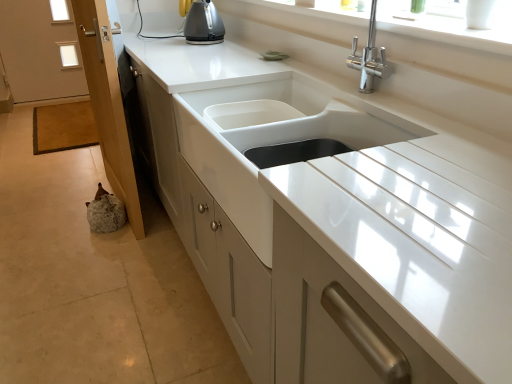
Question: Based on their positions, is wooden screen door at lower left located to the left or right of white glossy sink at center?

Choices:
 (A) right
 (B) left

Answer: (B)

Question: From a real-world perspective, is wooden screen door at lower left physically located above or below white glossy sink at center?

Choices:
 (A) above
 (B) below

Answer: (B)

Question: Does point (97, 71) appear closer or farther from the camera than point (400, 139)?

Choices:
 (A) closer
 (B) farther

Answer: (B)

Question: Is white glossy sink at center spatially inside wooden screen door at lower left, or outside of it?

Choices:
 (A) outside
 (B) inside

Answer: (A)

Question: Visually, is white glossy sink at center positioned to the left or to the right of wooden screen door at lower left?

Choices:
 (A) right
 (B) left

Answer: (A)

Question: Relative to wooden screen door at lower left, is white glossy sink at center in front or behind?

Choices:
 (A) behind
 (B) front

Answer: (B)

Question: Is point (320, 120) positioned closer to the camera than point (99, 69)?

Choices:
 (A) closer
 (B) farther

Answer: (A)